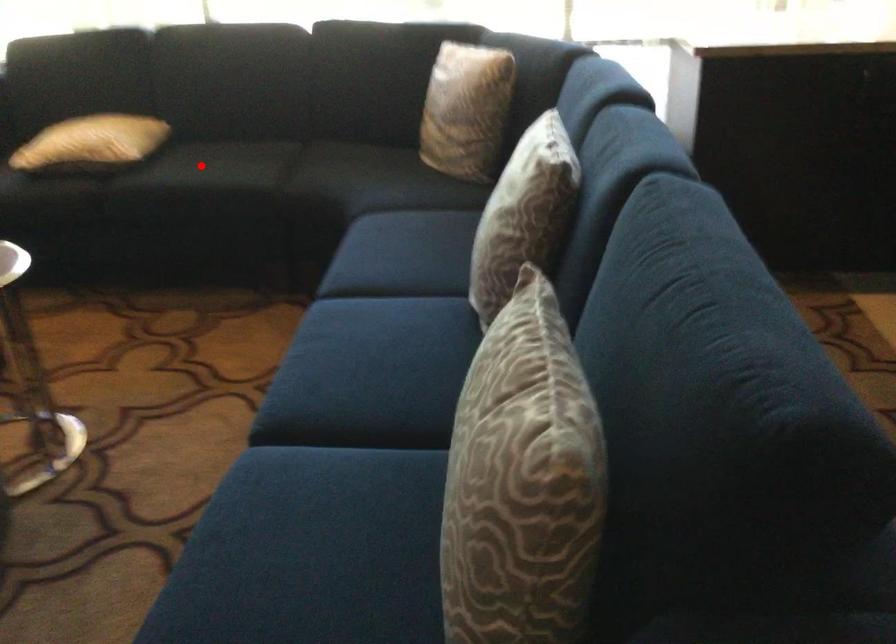
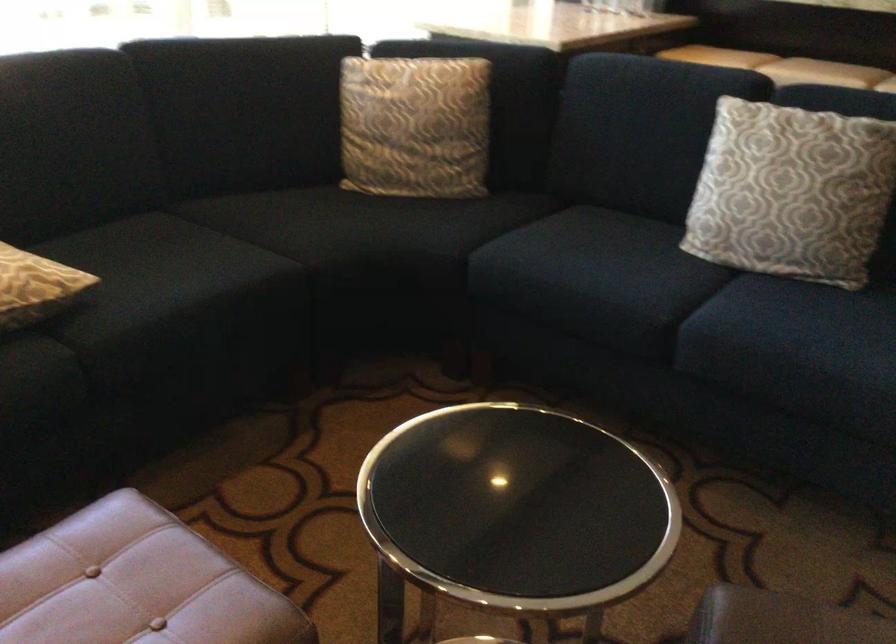
Question: I am providing you with two images of the same scene from different viewpoints. In image1, a red point is highlighted. Considering the same 3D point in image2, which of the following is correct?

Choices:
 (A) It is closer
 (B) It is farther

Answer: (A)